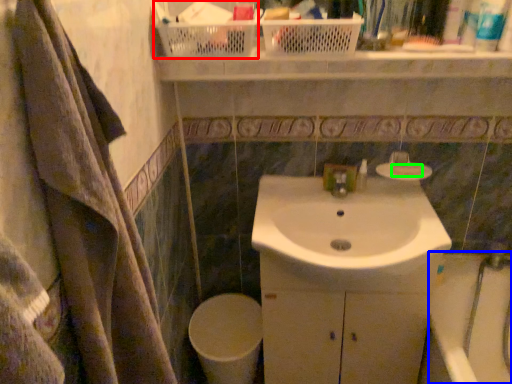
Question: Considering the real-world distances, which object is farthest from basket (highlighted by a red box)? bath (highlighted by a blue box) or soap (highlighted by a green box)?

Choices:
 (A) bath
 (B) soap

Answer: (A)